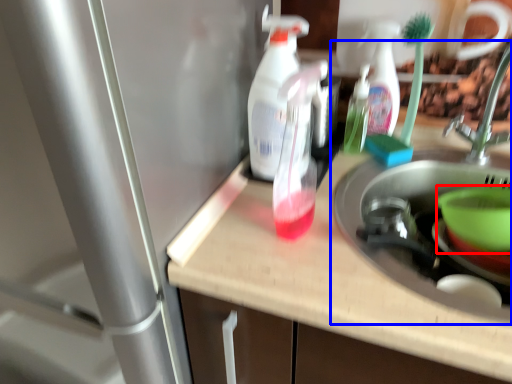
Question: Which point is further to the camera, basin (highlighted by a red box) or sink (highlighted by a blue box)?

Choices:
 (A) basin
 (B) sink

Answer: (A)